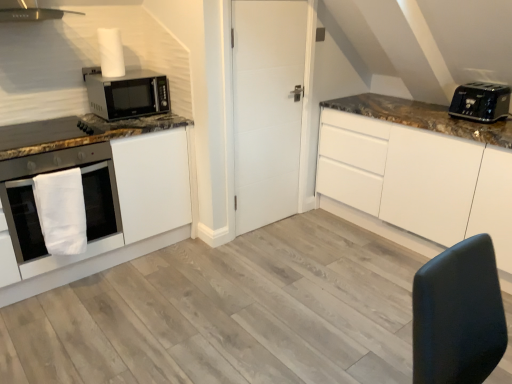
What do you see at coordinates (481, 102) in the screenshot?
I see `black plastic toaster at upper right` at bounding box center [481, 102].

Measure the distance between point (500, 94) and camera.

The depth of point (500, 94) is 2.53 meters.

At what (x,y) coordinates should I click in order to perform the action: click on matte black microwave at upper left. Please return your answer as a coordinate pair (x, y). Looking at the image, I should click on (127, 94).

I want to click on white matte cabinet at upper right, positioned as the 2th cabinetry in left-to-right order, so click(422, 163).

The width and height of the screenshot is (512, 384). I want to click on satin white cabinet at left, which is the second cabinetry from right to left, so click(95, 186).

I want to click on black plastic toaster at upper right, so click(x=481, y=102).

Is white cloth hand towel at lower left positioned with its back to black plastic toaster at upper right?

No, white cloth hand towel at lower left's orientation is not away from black plastic toaster at upper right.

Considering the sizes of white cloth hand towel at lower left and black plastic toaster at upper right in the image, is white cloth hand towel at lower left bigger or smaller than black plastic toaster at upper right?

In the image, white cloth hand towel at lower left appears to be larger than black plastic toaster at upper right.

Would you say white cloth hand towel at lower left is a long distance from black plastic toaster at upper right?

Indeed, white cloth hand towel at lower left is not near black plastic toaster at upper right.

At what (x,y) coordinates should I click in order to perform the action: click on hand towel below the black plastic toaster at upper right (from a real-world perspective). Please return your answer as a coordinate pair (x, y). Looking at the image, I should click on (61, 211).

Looking at their sizes, would you say white matte cabinet at upper right, which ranks as the first cabinetry in right-to-left order, is wider or thinner than satin white cabinet at left, which is the second cabinetry from right to left?

white matte cabinet at upper right, which ranks as the first cabinetry in right-to-left order, is wider than satin white cabinet at left, which is the second cabinetry from right to left.

From the image's perspective, which is below, white matte cabinet at upper right, positioned as the 2th cabinetry in left-to-right order, or satin white cabinet at left, positioned as the 1th cabinetry in left-to-right order?

satin white cabinet at left, positioned as the 1th cabinetry in left-to-right order, appears lower in the image.

Is white matte cabinet at upper right, which ranks as the first cabinetry in right-to-left order, not within satin white cabinet at left, positioned as the 1th cabinetry in left-to-right order?

That's correct, white matte cabinet at upper right, which ranks as the first cabinetry in right-to-left order, is outside of satin white cabinet at left, positioned as the 1th cabinetry in left-to-right order.

Is white matte cabinet at upper right, which ranks as the first cabinetry in right-to-left order, not close to satin white cabinet at left, which is the second cabinetry from right to left?

Absolutely, white matte cabinet at upper right, which ranks as the first cabinetry in right-to-left order, is distant from satin white cabinet at left, which is the second cabinetry from right to left.

From a real-world perspective, is black plastic toaster at upper right positioned over white matte cabinet at upper right, positioned as the 2th cabinetry in left-to-right order, based on gravity?

Indeed, from a real-world perspective, black plastic toaster at upper right stands above white matte cabinet at upper right, positioned as the 2th cabinetry in left-to-right order.

Is black plastic toaster at upper right touching white matte cabinet at upper right, which ranks as the first cabinetry in right-to-left order?

No, black plastic toaster at upper right is not making contact with white matte cabinet at upper right, which ranks as the first cabinetry in right-to-left order.

In the scene shown: Is black plastic toaster at upper right turned away from white matte cabinet at upper right, which ranks as the first cabinetry in right-to-left order?

No, black plastic toaster at upper right is not facing away from white matte cabinet at upper right, which ranks as the first cabinetry in right-to-left order.

Does white cloth hand towel at lower left turn towards white matte cabinet at upper right, positioned as the 2th cabinetry in left-to-right order?

No, white cloth hand towel at lower left is not turned towards white matte cabinet at upper right, positioned as the 2th cabinetry in left-to-right order.

Which is more to the right, white cloth hand towel at lower left or white matte cabinet at upper right, positioned as the 2th cabinetry in left-to-right order?

From the viewer's perspective, white matte cabinet at upper right, positioned as the 2th cabinetry in left-to-right order, appears more on the right side.

From the image's perspective, is white cloth hand towel at lower left above white matte cabinet at upper right, which ranks as the first cabinetry in right-to-left order?

No, from the image's perspective, white cloth hand towel at lower left is not above white matte cabinet at upper right, which ranks as the first cabinetry in right-to-left order.

Is white matte cabinet at upper right, positioned as the 2th cabinetry in left-to-right order, not within white cloth hand towel at lower left?

Absolutely, white matte cabinet at upper right, positioned as the 2th cabinetry in left-to-right order, is external to white cloth hand towel at lower left.

Which object is further away from the camera taking this photo, white matte cabinet at upper right, which ranks as the first cabinetry in right-to-left order, or white cloth hand towel at lower left?

Positioned behind is white cloth hand towel at lower left.

Is point (405, 104) closer or farther from the camera than point (70, 242)?

Point (405, 104).

In the scene shown: Does white matte cabinet at upper right, positioned as the 2th cabinetry in left-to-right order, have a larger size compared to white cloth hand towel at lower left?

Indeed, white matte cabinet at upper right, positioned as the 2th cabinetry in left-to-right order, has a larger size compared to white cloth hand towel at lower left.

From a real-world perspective, which object rests below the other?

white cloth hand towel at lower left.

Consider the image. Is white cloth hand towel at lower left located within matte black microwave at upper left?

No, white cloth hand towel at lower left is not a part of matte black microwave at upper left.

In the image, is matte black microwave at upper left on the left side or the right side of white cloth hand towel at lower left?

From the image, it's evident that matte black microwave at upper left is to the right of white cloth hand towel at lower left.

Is white matte door at center facing towards white cloth hand towel at lower left?

No, white matte door at center is not aimed at white cloth hand towel at lower left.

Can you confirm if white matte door at center is taller than white cloth hand towel at lower left?

Correct, white matte door at center is much taller as white cloth hand towel at lower left.

In the scene shown: From a real-world perspective, is white matte door at center physically below white cloth hand towel at lower left?

Actually, white matte door at center is physically above white cloth hand towel at lower left in the real world.

Can you tell me how much white matte door at center and white cloth hand towel at lower left differ in facing direction?

They differ by 1.7 degrees in their facing directions.

Where is `hand towel in front of the black plastic toaster at upper right`? hand towel in front of the black plastic toaster at upper right is located at coordinates (61, 211).

You are a GUI agent. You are given a task and a screenshot of the screen. Output one action in this format:
    pyautogui.click(x=<x>, y=<y>)
    Task: Click on the cabinetry that is above the satin white cabinet at left, positioned as the 1th cabinetry in left-to-right order (from the image's perspective)
    This screenshot has height=384, width=512.
    Given the screenshot: What is the action you would take?
    pyautogui.click(x=422, y=163)

Estimate the real-world distances between objects in this image. Which object is further from matte black microwave at upper left, black plastic toaster at upper right or white matte cabinet at upper right, which ranks as the first cabinetry in right-to-left order?

black plastic toaster at upper right.

Based on their spatial positions, is black plastic toaster at upper right or white glossy oven at left closer to white cloth hand towel at lower left?

white glossy oven at left is closer to white cloth hand towel at lower left.

In the scene shown: From the image, which object appears to be farther from white matte cabinet at upper right, which ranks as the first cabinetry in right-to-left order, white glossy oven at left or white cloth hand towel at lower left?

The object further to white matte cabinet at upper right, which ranks as the first cabinetry in right-to-left order, is white cloth hand towel at lower left.

From the image, which object appears to be farther from satin white cabinet at left, positioned as the 1th cabinetry in left-to-right order, white matte door at center or white matte cabinet at upper right, which ranks as the first cabinetry in right-to-left order?

Among the two, white matte cabinet at upper right, which ranks as the first cabinetry in right-to-left order, is located further to satin white cabinet at left, positioned as the 1th cabinetry in left-to-right order.

Considering their positions, is satin white cabinet at left, positioned as the 1th cabinetry in left-to-right order, positioned closer to white cloth hand towel at lower left than black plastic toaster at upper right?

satin white cabinet at left, positioned as the 1th cabinetry in left-to-right order.

Estimate the real-world distances between objects in this image. Which object is further from white cloth hand towel at lower left, white glossy oven at left or black plastic toaster at upper right?

black plastic toaster at upper right is further to white cloth hand towel at lower left.

When comparing their distances from white glossy oven at left, does satin white cabinet at left, which is the second cabinetry from right to left, or white cloth hand towel at lower left seem closer?

satin white cabinet at left, which is the second cabinetry from right to left, is positioned closer to the anchor white glossy oven at left.

Estimate the real-world distances between objects in this image. Which object is closer to white matte door at center, white cloth hand towel at lower left or black plastic toaster at upper right?

Based on the image, black plastic toaster at upper right appears to be nearer to white matte door at center.

At what (x,y) coordinates should I click in order to perform the action: click on hand towel located between white glossy oven at left and black plastic toaster at upper right in the left-right direction. Please return your answer as a coordinate pair (x, y). This screenshot has width=512, height=384. Looking at the image, I should click on (61, 211).

This screenshot has width=512, height=384. I want to click on microwave oven located between white cloth hand towel at lower left and white matte cabinet at upper right, which ranks as the first cabinetry in right-to-left order, in the left-right direction, so click(127, 94).

Find the location of a particular element. hand towel between satin white cabinet at left, positioned as the 1th cabinetry in left-to-right order, and black plastic toaster at upper right from left to right is located at coordinates (61, 211).

Locate an element on the screen. microwave oven situated between white glossy oven at left and black plastic toaster at upper right from left to right is located at coordinates (127, 94).